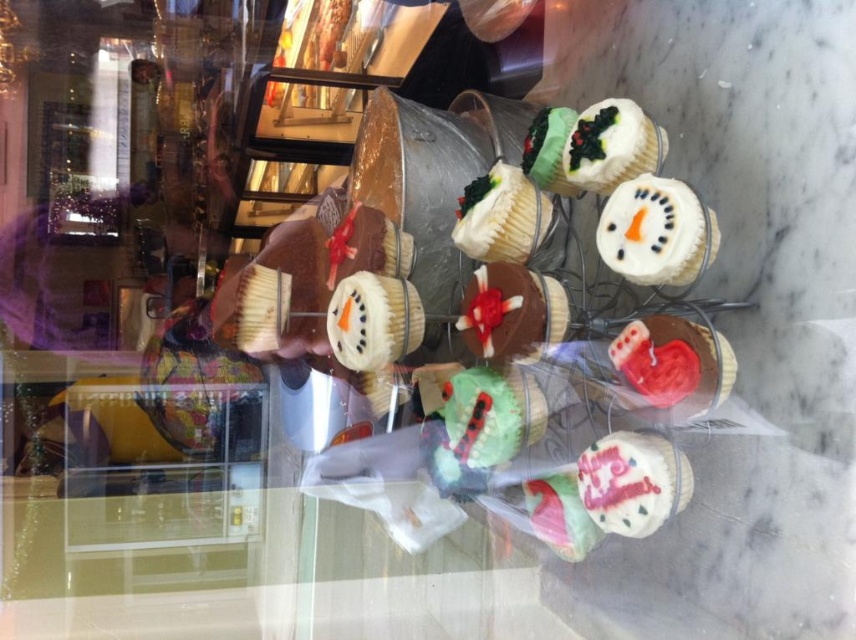
Is white frosted cupcake at center positioned behind green matte cupcake at center?

No, white frosted cupcake at center is closer to the viewer.

Can you confirm if white frosted cupcake at center is bigger than green matte cupcake at center?

No.

What do you see at coordinates (632, 483) in the screenshot? I see `white frosted cupcake at center` at bounding box center [632, 483].

This screenshot has width=856, height=640. Identify the location of white frosted cupcake at center. (632, 483).

Looking at this image, which is above, white fondant cupcake at upper right or white frosted cupcake at center?

white fondant cupcake at upper right

Between point (603, 234) and point (639, 508), which one is positioned behind?

Point (603, 234)

At what (x,y) coordinates should I click in order to perform the action: click on white fondant cupcake at upper right. Please return your answer as a coordinate pair (x, y). Looking at the image, I should click on (657, 230).

Which is behind, point (672, 195) or point (462, 227)?

Positioned behind is point (462, 227).

You are a GUI agent. You are given a task and a screenshot of the screen. Output one action in this format:
    pyautogui.click(x=<x>, y=<y>)
    Task: Click on the white fondant cupcake at upper right
    
    Given the screenshot: What is the action you would take?
    pyautogui.click(x=657, y=230)